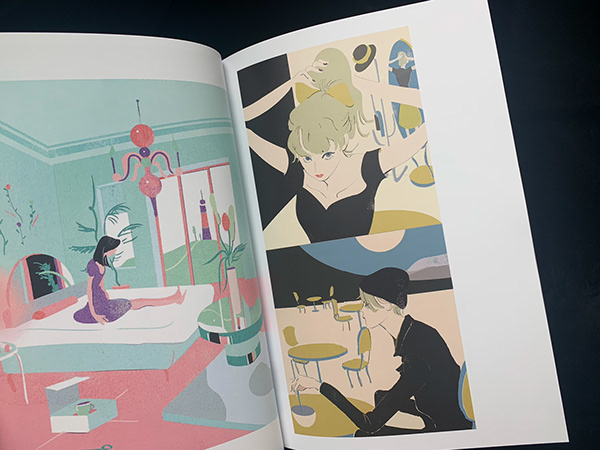
You are a GUI agent. You are given a task and a screenshot of the screen. Output one action in this format:
    pyautogui.click(x=<x>, y=<y>)
    Task: Click on the chairs
    
    Given the screenshot: What is the action you would take?
    pyautogui.click(x=468, y=396), pyautogui.click(x=363, y=341), pyautogui.click(x=289, y=333), pyautogui.click(x=344, y=317), pyautogui.click(x=296, y=294), pyautogui.click(x=331, y=290)